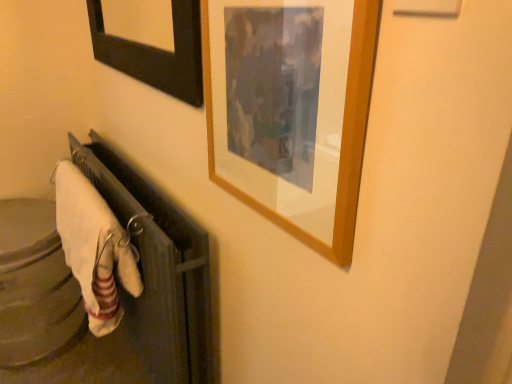
Question: From the image's perspective, is white soft towel at lower left above or below wooden picture frame at upper right?

Choices:
 (A) above
 (B) below

Answer: (B)

Question: Would you say white soft towel at lower left is inside or outside wooden picture frame at upper right?

Choices:
 (A) inside
 (B) outside

Answer: (B)

Question: In terms of width, does white soft towel at lower left look wider or thinner when compared to wooden picture frame at upper right?

Choices:
 (A) thin
 (B) wide

Answer: (B)

Question: Is point (346, 165) closer or farther from the camera than point (80, 249)?

Choices:
 (A) farther
 (B) closer

Answer: (B)

Question: Would you say wooden picture frame at upper right is to the left or to the right of white soft towel at lower left in the picture?

Choices:
 (A) right
 (B) left

Answer: (A)

Question: From the image's perspective, is wooden picture frame at upper right located above or below white soft towel at lower left?

Choices:
 (A) below
 (B) above

Answer: (B)

Question: Considering the positions of wooden picture frame at upper right and white soft towel at lower left in the image, is wooden picture frame at upper right taller or shorter than white soft towel at lower left?

Choices:
 (A) tall
 (B) short

Answer: (B)